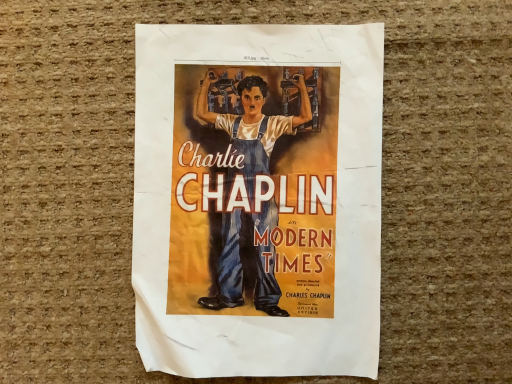
This screenshot has height=384, width=512. I want to click on empty space that is ontop of matte paper poster at center (from a real-world perspective), so (265, 194).